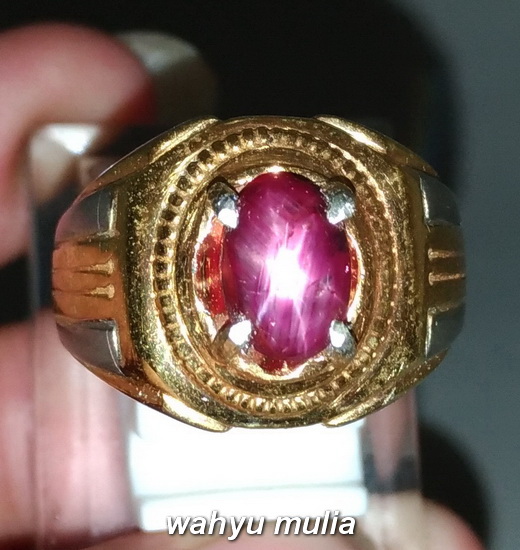
Identify the location of glass. Image resolution: width=520 pixels, height=550 pixels. (84, 478).